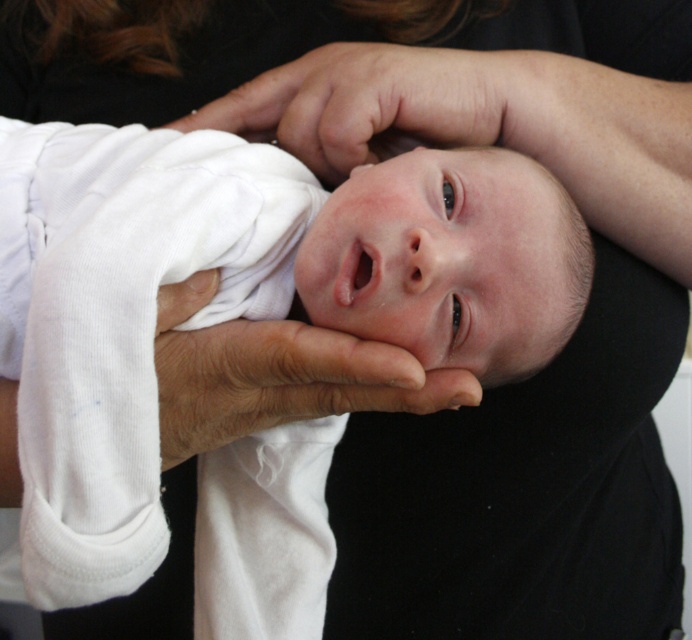
You are a photographer trying to capture the baby in the image. You notice two points marked in the scene. Which point is closer to the camera, point (239,344) or point (343,129)?

Point (239,344) is in front of point (343,129), so it is closer to the camera.

You are a pediatrician examining the newborn in the image. You notice two hands holding the baby. Which hand is narrower between the dry skin hand at center and the smooth skin hand at center?

The dry skin hand at center is narrower than the smooth skin hand at center.